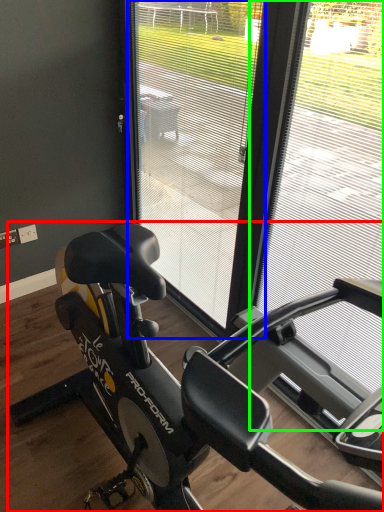
Question: Which is farther away from stationary bicycle (highlighted by a red box)? screen door (highlighted by a blue box) or window frame (highlighted by a green box)?

Choices:
 (A) screen door
 (B) window frame

Answer: (A)